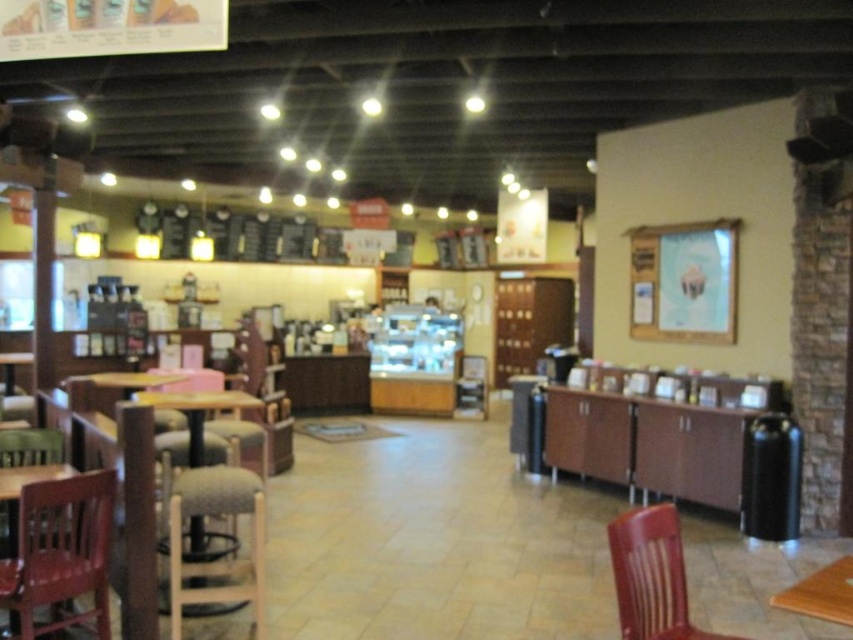
Question: Which object is closer to the camera taking this photo?

Choices:
 (A) fabric cushioned bar stool at lower left
 (B) brown wooden chair at lower right
 (C) wooden table at center

Answer: (B)

Question: Is wooden table at center positioned before brown wood table at lower right?

Choices:
 (A) yes
 (B) no

Answer: (B)

Question: Can you confirm if fabric cushioned bar stool at lower left is positioned to the left of wooden table at center?

Choices:
 (A) yes
 (B) no

Answer: (B)

Question: Among these objects, which one is nearest to the camera?

Choices:
 (A) wooden chair at lower left
 (B) fabric cushioned bar stool at lower left
 (C) brown wooden chair at lower right

Answer: (C)

Question: Is brown wooden chair at lower right to the left of brown wood table at lower right from the viewer's perspective?

Choices:
 (A) no
 (B) yes

Answer: (B)

Question: Which object appears farthest from the camera in this image?

Choices:
 (A) brown wood table at lower right
 (B) brown wooden chair at lower right
 (C) fabric cushioned bar stool at lower left

Answer: (C)